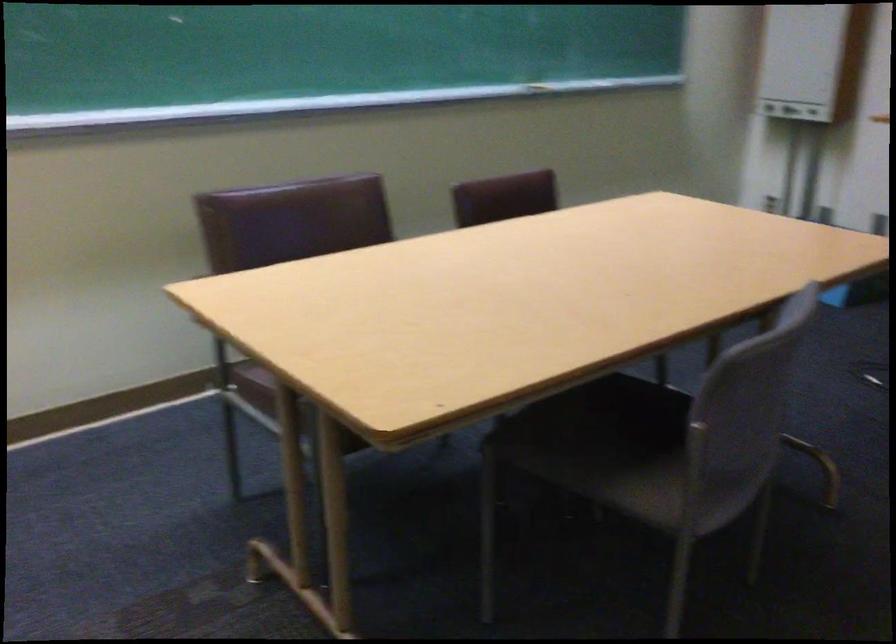
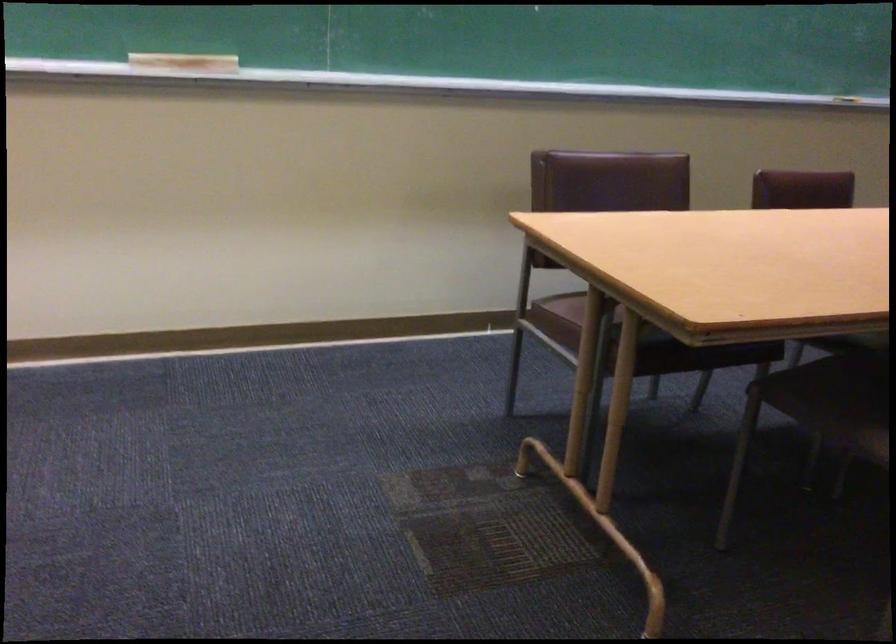
In the second image, find the point that corresponds to (x=572, y=431) in the first image.

(833, 391)